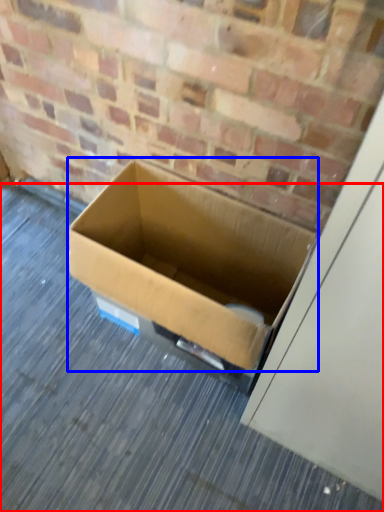
Question: Which object is further to the camera taking this photo, alley (highlighted by a red box) or box (highlighted by a blue box)?

Choices:
 (A) alley
 (B) box

Answer: (A)